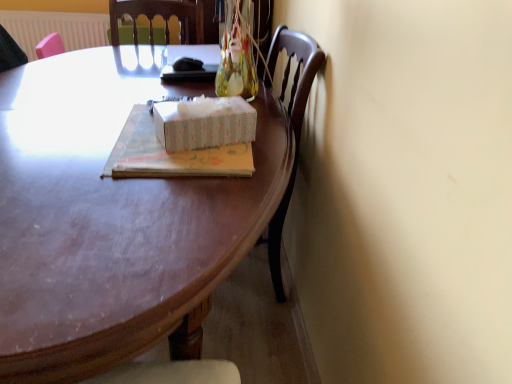
This screenshot has width=512, height=384. What are the coordinates of `white paper tissue box at center` in the screenshot? It's located at (204, 123).

You are a GUI agent. You are given a task and a screenshot of the screen. Output one action in this format:
    pyautogui.click(x=<x>, y=<y>)
    Task: Click on the white textured radiator at upper left
    The height and width of the screenshot is (384, 512).
    Given the screenshot: What is the action you would take?
    pyautogui.click(x=55, y=29)

This screenshot has width=512, height=384. Describe the element at coordinates (110, 220) in the screenshot. I see `shiny brown desk at center` at that location.

Identify the location of matte paper book at center. (170, 154).

Does point (150, 286) come in front of point (42, 26)?

Yes, point (150, 286) is in front of point (42, 26).

Consider the image. From a real-world perspective, is shiny brown desk at center located higher than white textured radiator at upper left?

No, from a real-world perspective, shiny brown desk at center is not over white textured radiator at upper left

Which object is wider, shiny brown desk at center or white textured radiator at upper left?

shiny brown desk at center is wider.

Measure the distance between matte paper book at center and shiny brown desk at center.

matte paper book at center is 5.45 inches from shiny brown desk at center.

Which object is positioned more to the right, matte paper book at center or shiny brown desk at center?

Positioned to the right is matte paper book at center.

Is matte paper book at center oriented towards shiny brown desk at center?

No, matte paper book at center is not aimed at shiny brown desk at center.

Based on the photo, does matte paper book at center have a larger size compared to shiny brown desk at center?

No.

Is point (139, 163) less distant than point (70, 16)?

Yes, it is in front of point (70, 16).

Which is more to the left, matte paper book at center or white textured radiator at upper left?

Positioned to the left is white textured radiator at upper left.

Which is in front, matte paper book at center or white textured radiator at upper left?

matte paper book at center.

Can you see matte paper book at center touching white textured radiator at upper left?

No, matte paper book at center is not with white textured radiator at upper left.

Who is smaller, white textured radiator at upper left or shiny brown desk at center?

white textured radiator at upper left.

You are a GUI agent. You are given a task and a screenshot of the screen. Output one action in this format:
    pyautogui.click(x=<x>, y=<y>)
    Task: Click on the desk on the right of white textured radiator at upper left
    
    Given the screenshot: What is the action you would take?
    pyautogui.click(x=110, y=220)

From a real-world perspective, is white textured radiator at upper left below shiny brown desk at center?

No, from a real-world perspective, white textured radiator at upper left is not below shiny brown desk at center.

From a real-world perspective, is white paper tissue box at center positioned under matte paper book at center based on gravity?

No, from a real-world perspective, white paper tissue box at center is not below matte paper book at center.

Which is behind, point (161, 129) or point (178, 176)?

The point (161, 129) is behind.

From the image's perspective, who appears lower, white paper tissue box at center or matte paper book at center?

matte paper book at center, from the image's perspective.

From a real-world perspective, is white paper tissue box at center over shiny brown desk at center?

Correct, in the physical world, white paper tissue box at center is higher than shiny brown desk at center.

Looking at their sizes, would you say white paper tissue box at center is wider or thinner than shiny brown desk at center?

white paper tissue box at center is thinner than shiny brown desk at center.

Looking at this image, is white paper tissue box at center looking in the opposite direction of shiny brown desk at center?

white paper tissue box at center is not turned away from shiny brown desk at center.

Can you tell me how much white paper tissue box at center and shiny brown desk at center differ in facing direction?

The facing directions of white paper tissue box at center and shiny brown desk at center are 17.4 degrees apart.

Is white textured radiator at upper left bigger than white paper tissue box at center?

Correct, white textured radiator at upper left is larger in size than white paper tissue box at center.

Choose the correct answer: Is white textured radiator at upper left inside white paper tissue box at center or outside it?

white textured radiator at upper left is not inside white paper tissue box at center, it's outside.

Find the location of a particular element. radiator that is under the white paper tissue box at center (from a real-world perspective) is located at coordinates (55, 29).

Measure the distance between white textured radiator at upper left and white paper tissue box at center.

A distance of 1.93 meters exists between white textured radiator at upper left and white paper tissue box at center.

This screenshot has height=384, width=512. Find the location of `radiator lying above the shiny brown desk at center (from the image's perspective)`. radiator lying above the shiny brown desk at center (from the image's perspective) is located at coordinates (55, 29).

Identify the location of book on the right of shiny brown desk at center. (170, 154).

When comparing their distances from shiny brown desk at center, does white paper tissue box at center or matte paper book at center seem further?

white paper tissue box at center is further to shiny brown desk at center.

Based on their spatial positions, is matte paper book at center or shiny brown desk at center closer to white textured radiator at upper left?

Based on the image, shiny brown desk at center appears to be nearer to white textured radiator at upper left.

When comparing their distances from matte paper book at center, does white paper tissue box at center or white textured radiator at upper left seem closer?

The object closer to matte paper book at center is white paper tissue box at center.

From the image, which object appears to be farther from shiny brown desk at center, matte paper book at center or white textured radiator at upper left?

white textured radiator at upper left is positioned further to the anchor shiny brown desk at center.

Which object lies nearer to the anchor point matte paper book at center, white textured radiator at upper left or white paper tissue box at center?

white paper tissue box at center.

Considering their positions, is shiny brown desk at center positioned closer to white textured radiator at upper left than white paper tissue box at center?

shiny brown desk at center lies closer to white textured radiator at upper left than the other object.

Estimate the real-world distances between objects in this image. Which object is closer to matte paper book at center, shiny brown desk at center or white textured radiator at upper left?

Based on the image, shiny brown desk at center appears to be nearer to matte paper book at center.

Based on their spatial positions, is shiny brown desk at center or white textured radiator at upper left closer to white paper tissue box at center?

shiny brown desk at center lies closer to white paper tissue box at center than the other object.

Find the location of `book positioned between shiny brown desk at center and white paper tissue box at center from near to far`. book positioned between shiny brown desk at center and white paper tissue box at center from near to far is located at coordinates (170, 154).

Where is `box between shiny brown desk at center and white textured radiator at upper left along the z-axis`? The image size is (512, 384). box between shiny brown desk at center and white textured radiator at upper left along the z-axis is located at coordinates (204, 123).

Find the location of a particular element. The height and width of the screenshot is (384, 512). box between matte paper book at center and white textured radiator at upper left along the z-axis is located at coordinates (204, 123).

Find the location of `book between shiny brown desk at center and white textured radiator at upper left from front to back`. book between shiny brown desk at center and white textured radiator at upper left from front to back is located at coordinates (170, 154).